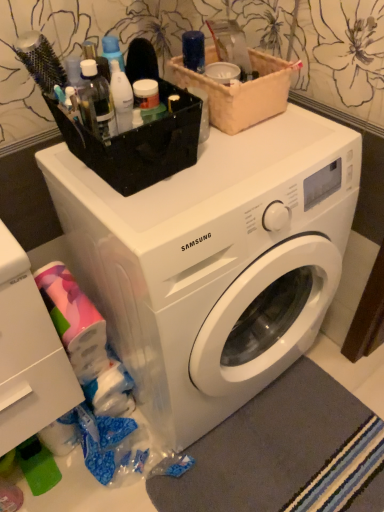
Question: Considering the relative positions of gray soft rug at lower right and white plastic washing machine at center in the image provided, is gray soft rug at lower right to the right of white plastic washing machine at center from the viewer's perspective?

Choices:
 (A) no
 (B) yes

Answer: (B)

Question: Is gray soft rug at lower right positioned with its back to white plastic washing machine at center?

Choices:
 (A) yes
 (B) no

Answer: (B)

Question: Does gray soft rug at lower right have a greater height compared to white plastic washing machine at center?

Choices:
 (A) yes
 (B) no

Answer: (B)

Question: Is gray soft rug at lower right thinner than white plastic washing machine at center?

Choices:
 (A) yes
 (B) no

Answer: (A)

Question: From a real-world perspective, is gray soft rug at lower right positioned over white plastic washing machine at center based on gravity?

Choices:
 (A) yes
 (B) no

Answer: (B)

Question: Which is correct: gray soft rug at lower right is inside white plastic washing machine at center, or outside of it?

Choices:
 (A) inside
 (B) outside

Answer: (B)

Question: Based on their positions, is gray soft rug at lower right located to the left or right of white plastic washing machine at center?

Choices:
 (A) left
 (B) right

Answer: (B)

Question: From a real-world perspective, relative to white plastic washing machine at center, is gray soft rug at lower right vertically above or below?

Choices:
 (A) below
 (B) above

Answer: (A)

Question: In terms of height, does gray soft rug at lower right look taller or shorter compared to white plastic washing machine at center?

Choices:
 (A) short
 (B) tall

Answer: (A)

Question: Is white plastic washing machine at center in front of or behind white plastic drawer at lower left in the image?

Choices:
 (A) behind
 (B) front

Answer: (A)

Question: From the image's perspective, is white plastic washing machine at center located above or below white plastic drawer at lower left?

Choices:
 (A) below
 (B) above

Answer: (B)

Question: Looking at their shapes, would you say white plastic washing machine at center is wider or thinner than white plastic drawer at lower left?

Choices:
 (A) wide
 (B) thin

Answer: (A)

Question: In terms of height, does white plastic washing machine at center look taller or shorter compared to white plastic drawer at lower left?

Choices:
 (A) short
 (B) tall

Answer: (B)

Question: Considering the positions of point (9, 320) and point (291, 65), is point (9, 320) closer or farther from the camera than point (291, 65)?

Choices:
 (A) closer
 (B) farther

Answer: (A)

Question: Looking at the image, does white plastic drawer at lower left seem bigger or smaller compared to beige fabric basket at upper center?

Choices:
 (A) big
 (B) small

Answer: (A)